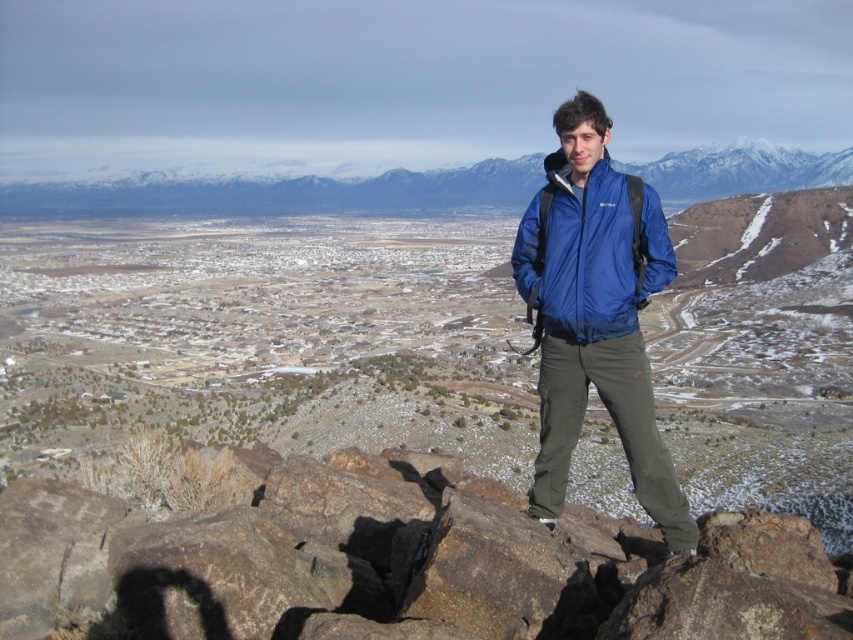
Question: Can you confirm if blue fabric jacket at center is smaller than blue waterproof jacket at center?

Choices:
 (A) no
 (B) yes

Answer: (A)

Question: Considering the real-world distances, which object is farthest from the snowy mountain range at upper center?

Choices:
 (A) blue waterproof jacket at center
 (B) blue fabric jacket at center
 (C) brown rough rock at center

Answer: (A)

Question: Is blue fabric jacket at center smaller than blue waterproof jacket at center?

Choices:
 (A) no
 (B) yes

Answer: (A)

Question: Is brown rough rock at center to the left of snowy mountain range at upper center from the viewer's perspective?

Choices:
 (A) yes
 (B) no

Answer: (B)

Question: Estimate the real-world distances between objects in this image. Which object is closer to the blue fabric jacket at center?

Choices:
 (A) blue waterproof jacket at center
 (B) snowy mountain range at upper center
 (C) brown rough rock at center

Answer: (A)

Question: Estimate the real-world distances between objects in this image. Which object is closer to the blue waterproof jacket at center?

Choices:
 (A) snowy mountain range at upper center
 (B) brown rough rock at center

Answer: (B)